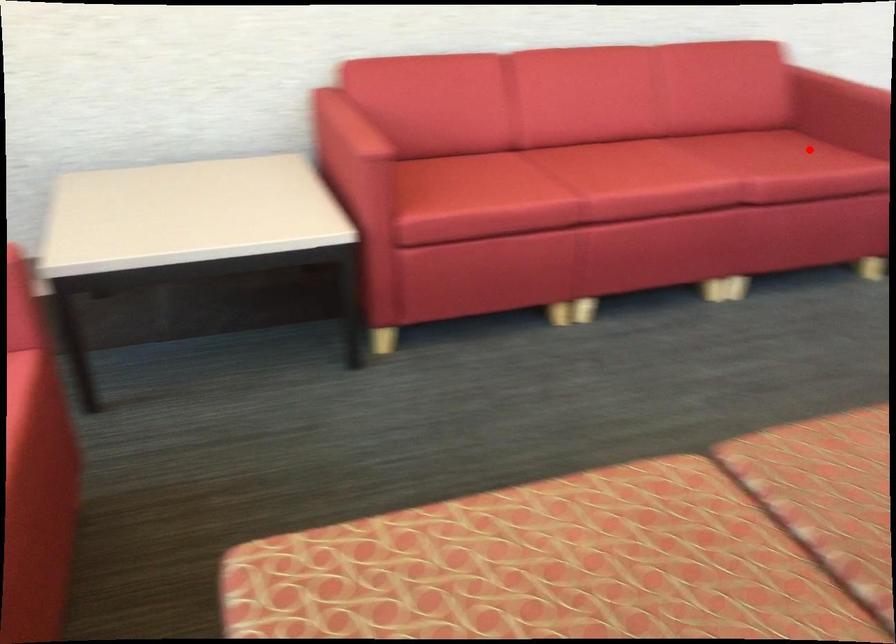
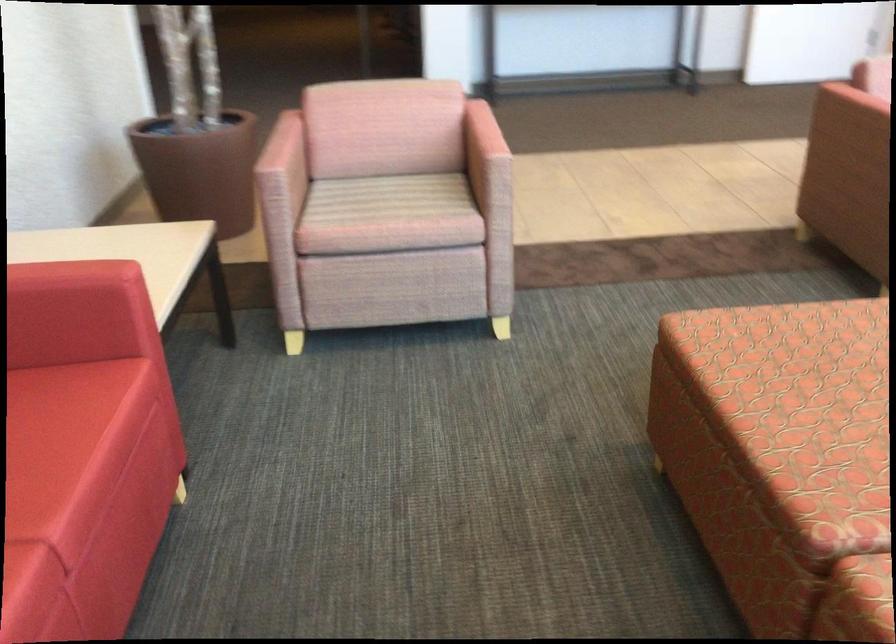
Question: A red point is marked in image1. In image2, is the corresponding 3D point closer to the camera or farther? Reply with the corresponding letter.

Choices:
 (A) The corresponding 3D point is closer.
 (B) The corresponding 3D point is farther.

Answer: (A)